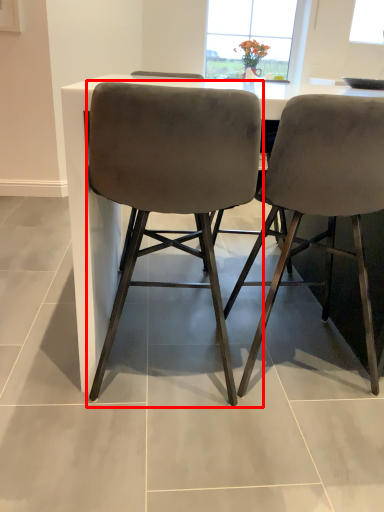
Question: Considering the relative positions of chair (annotated by the red box) and chair in the image provided, where is chair (annotated by the red box) located with respect to the staircase?

Choices:
 (A) left
 (B) right

Answer: (A)